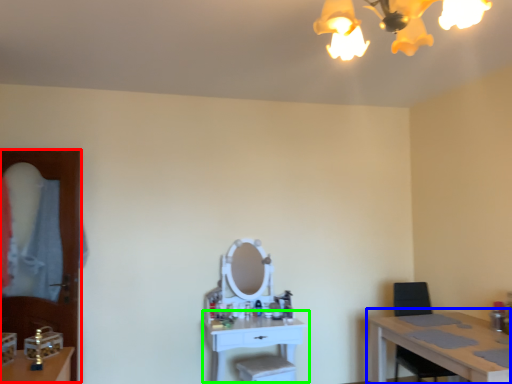
Question: Which object is positioned farthest from glass door (highlighted by a red box)? Select from table (highlighted by a blue box) and table (highlighted by a green box).

Choices:
 (A) table
 (B) table

Answer: (A)